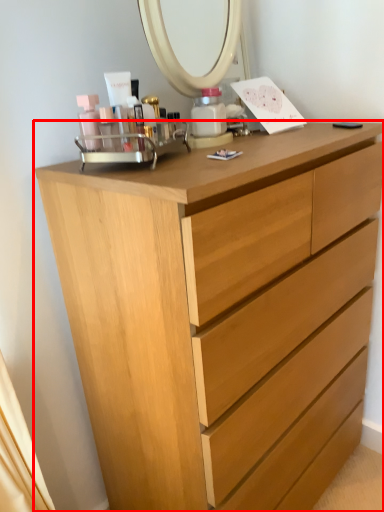
Question: From the image's perspective, where is chest of drawers (annotated by the red box) located relative to toiletry?

Choices:
 (A) below
 (B) above

Answer: (A)